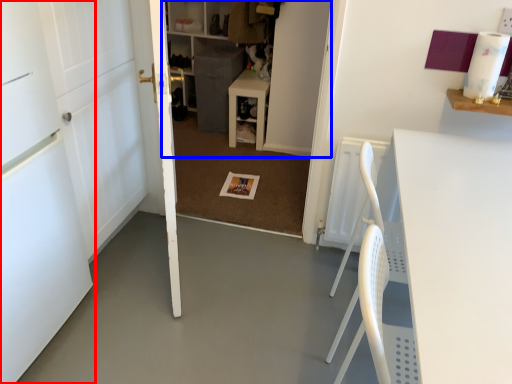
Question: Among these objects, which one is farthest to the camera, door (highlighted by a red box) or bookshelf (highlighted by a blue box)?

Choices:
 (A) door
 (B) bookshelf

Answer: (B)